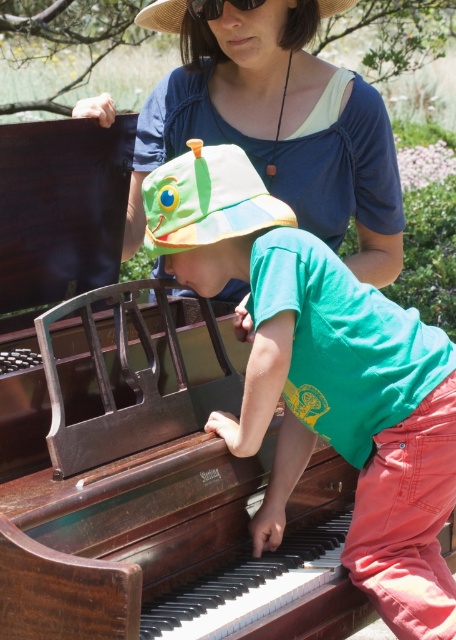
Who is positioned more to the left, multicolored fabric hat at center or straw hat at upper center?

straw hat at upper center is more to the left.

Which is behind, point (253, 212) or point (174, 20)?

The point (174, 20) is behind.

You are a GUI agent. You are given a task and a screenshot of the screen. Output one action in this format:
    pyautogui.click(x=<x>, y=<y>)
    Task: Click on the multicolored fabric hat at center
    The image size is (456, 640).
    Given the screenshot: What is the action you would take?
    pyautogui.click(x=207, y=198)

Can you confirm if wooden piano at center is shorter than multicolored fabric hat at center?

In fact, wooden piano at center may be taller than multicolored fabric hat at center.

Is wooden piano at center to the right of multicolored fabric hat at center from the viewer's perspective?

Incorrect, wooden piano at center is not on the right side of multicolored fabric hat at center.

Who is more forward, (217, 593) or (257, 179)?

Point (217, 593) is in front.

Find the location of `wooden piano at center`. wooden piano at center is located at coordinates (131, 429).

Which is behind, point (156, 196) or point (253, 225)?

The point (156, 196) is more distant.

Is green cotton hat at upper center positioned before multicolored fabric hat at center?

That is True.

Between point (238, 211) and point (181, 208), which one is positioned behind?

Positioned behind is point (238, 211).

Where is `green cotton hat at upper center`? The height and width of the screenshot is (640, 456). green cotton hat at upper center is located at coordinates (324, 378).